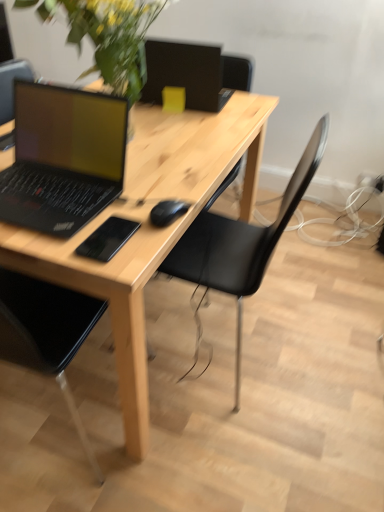
Question: Is matte black laptop at left aimed at black matte mousepad at center?

Choices:
 (A) no
 (B) yes

Answer: (A)

Question: Does matte black laptop at left have a larger size compared to black matte mousepad at center?

Choices:
 (A) no
 (B) yes

Answer: (B)

Question: From the image's perspective, would you say matte black laptop at left is positioned over black matte mousepad at center?

Choices:
 (A) yes
 (B) no

Answer: (A)

Question: Is matte black laptop at left shorter than black matte mousepad at center?

Choices:
 (A) yes
 (B) no

Answer: (B)

Question: From a real-world perspective, is matte black laptop at left on black matte mousepad at center?

Choices:
 (A) yes
 (B) no

Answer: (A)

Question: From the image's perspective, is matte black laptop at left above or below black matte mousepad at center?

Choices:
 (A) above
 (B) below

Answer: (A)

Question: In the image, is matte black laptop at left positioned in front of or behind black matte mousepad at center?

Choices:
 (A) behind
 (B) front

Answer: (B)

Question: Is matte black laptop at left bigger or smaller than black matte mousepad at center?

Choices:
 (A) big
 (B) small

Answer: (A)

Question: From a real-world perspective, relative to black matte mousepad at center, is matte black laptop at left vertically above or below?

Choices:
 (A) above
 (B) below

Answer: (A)

Question: Looking at their shapes, would you say green leafy plant at upper left is wider or thinner than black plastic chair at center?

Choices:
 (A) thin
 (B) wide

Answer: (A)

Question: In the image, is green leafy plant at upper left positioned in front of or behind black plastic chair at center?

Choices:
 (A) front
 (B) behind

Answer: (A)

Question: Choose the correct answer: Is green leafy plant at upper left inside black plastic chair at center or outside it?

Choices:
 (A) inside
 (B) outside

Answer: (B)

Question: Is point (97, 19) closer or farther from the camera than point (269, 228)?

Choices:
 (A) farther
 (B) closer

Answer: (B)

Question: Is natural wood desk at center in front of or behind matte black laptop at left in the image?

Choices:
 (A) front
 (B) behind

Answer: (B)

Question: Is natural wood desk at center situated inside matte black laptop at left or outside?

Choices:
 (A) inside
 (B) outside

Answer: (B)